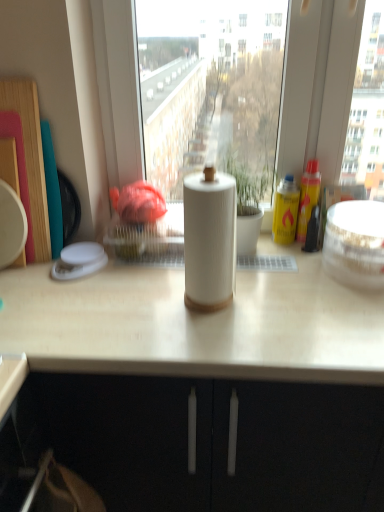
Image resolution: width=384 pixels, height=512 pixels. I want to click on free space between white matte paper towel at center and white plastic container at left, the 2th appliance in the right-to-left sequence, so click(131, 286).